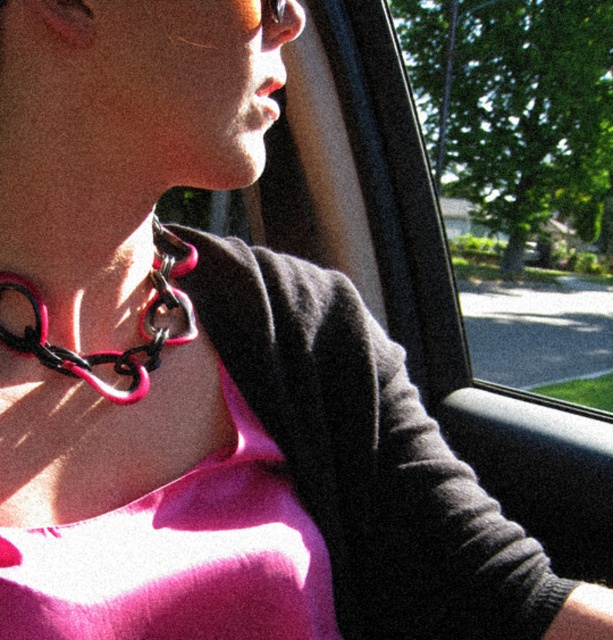
Looking at this image, you are a passenger in the car and want to hang a small keychain on the pink plastic chain at center. Can you attach it without it touching the transparent glass at center?

The transparent glass at center has a greater height compared to the pink plastic chain at center. Since the glass is taller, the keychain might still touch the glass when attached to the chain.

You are a passenger in a car and want to point out two items in the scene. The first item is the transparent glass at center, and the second is the pink plastic chain at center. Which one is located to the right of the other?

The transparent glass at center is positioned on the right side of the pink plastic chain at center.